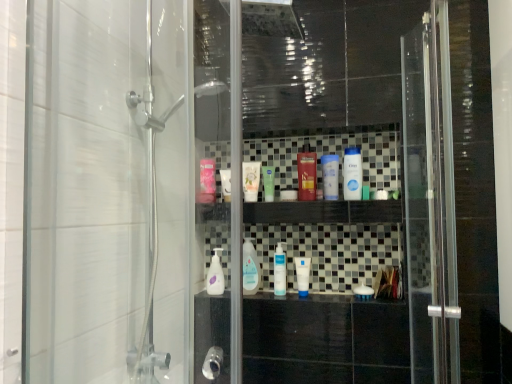
Question: Does white matte tube at center, the second toiletry positioned from the left, have a greater width compared to pink glossy mouthwash at center, acting as the seventh mouthwash starting from the right?

Choices:
 (A) no
 (B) yes

Answer: (A)

Question: From a real-world perspective, is white matte tube at center, the second toiletry positioned from the left, positioned over pink glossy mouthwash at center, marked as the first mouthwash in a left-to-right arrangement, based on gravity?

Choices:
 (A) yes
 (B) no

Answer: (B)

Question: Does white matte tube at center, the second toiletry positioned from the left, have a greater height compared to pink glossy mouthwash at center, acting as the seventh mouthwash starting from the right?

Choices:
 (A) no
 (B) yes

Answer: (A)

Question: From the image's perspective, does white matte tube at center, the second toiletry positioned from the left, appear higher than pink glossy mouthwash at center, marked as the first mouthwash in a left-to-right arrangement?

Choices:
 (A) no
 (B) yes

Answer: (A)

Question: From a real-world perspective, does white matte tube at center, the 1th toiletry ordered from the bottom, sit lower than pink glossy mouthwash at center, acting as the seventh mouthwash starting from the right?

Choices:
 (A) no
 (B) yes

Answer: (B)

Question: Is white matte tube at center, the 1th toiletry ordered from the bottom, in front of or behind white glossy mouthwash at center, which appears as the fourth mouthwash when viewed from the right, in the image?

Choices:
 (A) behind
 (B) front

Answer: (B)

Question: Does point (306, 284) appear closer or farther from the camera than point (281, 284)?

Choices:
 (A) closer
 (B) farther

Answer: (B)

Question: From the image's perspective, is white matte tube at center, acting as the first toiletry starting from the right, located above or below white glossy mouthwash at center, which appears as the fourth mouthwash when viewed from the right?

Choices:
 (A) below
 (B) above

Answer: (A)

Question: Considering the positions of white matte tube at center, the second toiletry from the top, and white glossy mouthwash at center, which appears as the fourth mouthwash when viewed from the right, in the image, is white matte tube at center, the second toiletry from the top, wider or thinner than white glossy mouthwash at center, which appears as the fourth mouthwash when viewed from the right,?

Choices:
 (A) wide
 (B) thin

Answer: (A)

Question: Visually, is clear plastic mouthwash at center, the 2th mouthwash from the left, positioned to the left or to the right of green matte tube at center, the fifth mouthwash when ordered from right to left?

Choices:
 (A) left
 (B) right

Answer: (A)

Question: From a real-world perspective, is clear plastic mouthwash at center, acting as the 6th mouthwash starting from the right, positioned above or below green matte tube at center, placed as the third mouthwash when sorted from left to right?

Choices:
 (A) below
 (B) above

Answer: (A)

Question: Considering their positions, is clear plastic mouthwash at center, the 2th mouthwash from the left, located in front of or behind green matte tube at center, the fifth mouthwash when ordered from right to left?

Choices:
 (A) front
 (B) behind

Answer: (B)

Question: Does point (259, 276) appear closer or farther from the camera than point (271, 178)?

Choices:
 (A) closer
 (B) farther

Answer: (A)

Question: Considering their positions, is white glossy mouthwash at center, marked as the 4th mouthwash in a left-to-right arrangement, located in front of or behind pink glossy mouthwash at center, acting as the seventh mouthwash starting from the right?

Choices:
 (A) front
 (B) behind

Answer: (A)

Question: Considering the positions of point (276, 284) and point (206, 172), is point (276, 284) closer or farther from the camera than point (206, 172)?

Choices:
 (A) farther
 (B) closer

Answer: (A)